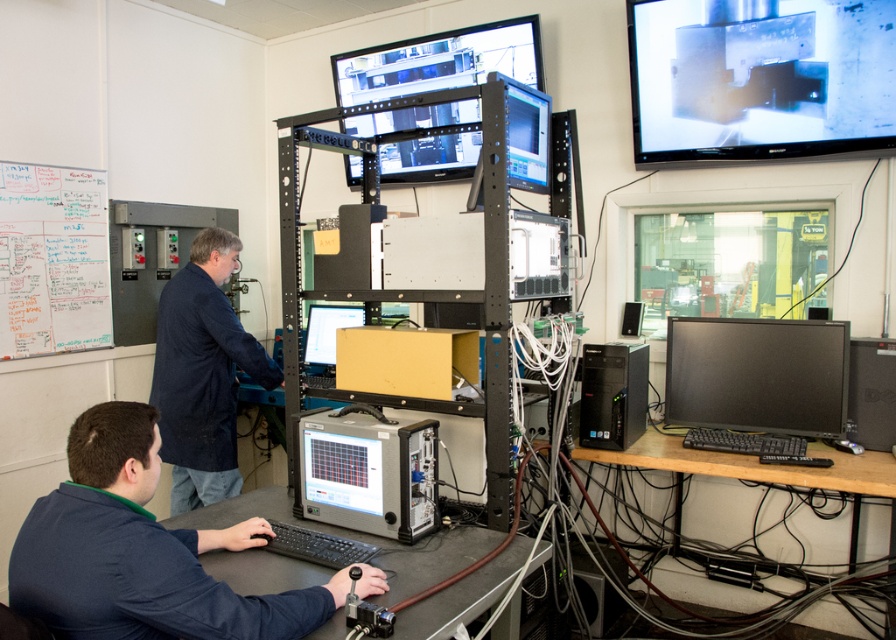
Looking at this image, you are a technician entering the control room and need to locate the dark blue shirt at lower left and the black matte monitor at lower right. Which object is wider?

The dark blue shirt at lower left is wider than the black matte monitor at lower right according to the description.

You are an engineer in the control room and need to access both the black matte monitor at lower right and the matte black monitor at center. Which monitor would you have to reach over first to get to the other one?

The black matte monitor at lower right is in front of the matte black monitor at center, so you would need to reach over the black matte monitor at lower right first to access the matte black monitor at center.

You are standing in the control room and need to reach the black matte monitor at lower right. If your arm can extend 3 feet, can you touch it without moving closer?

The black matte monitor at lower right is 8.80 feet away from the viewer, which is farther than your arm can reach. You would need to move closer to touch it.